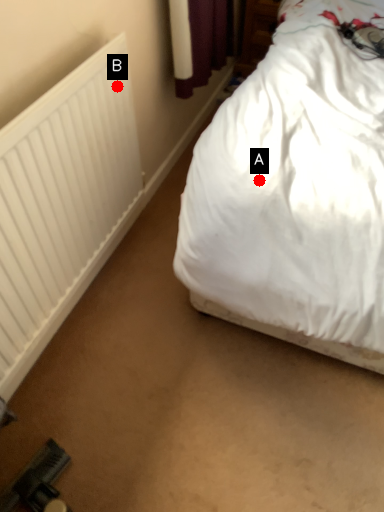
Question: Two points are circled on the image, labeled by A and B beside each circle. Which point is further to the camera?

Choices:
 (A) A is further
 (B) B is further

Answer: (B)